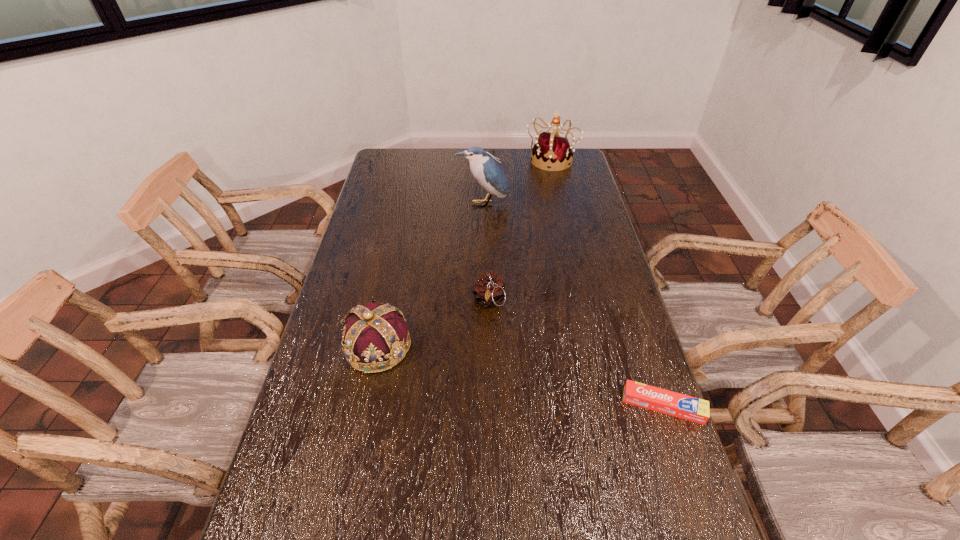
Where is `object positioned at the left edge`? This screenshot has width=960, height=540. object positioned at the left edge is located at coordinates (376, 337).

I want to click on toothpaste situated at the right edge, so click(x=686, y=407).

The image size is (960, 540). In order to click on tiara that is at the right edge in this screenshot , I will do `click(552, 150)`.

Where is `object at the far right corner`? Image resolution: width=960 pixels, height=540 pixels. object at the far right corner is located at coordinates (552, 150).

The image size is (960, 540). Identify the location of free space at the left edge of the desktop. (379, 270).

The image size is (960, 540). Find the location of `vacant space at the right edge of the desktop`. vacant space at the right edge of the desktop is located at coordinates (555, 177).

Locate an element on the screen. The image size is (960, 540). free point at the far right corner is located at coordinates (577, 148).

Image resolution: width=960 pixels, height=540 pixels. What are the coordinates of `free space between the second shortest object and the bird` in the screenshot? It's located at (486, 253).

Find the location of `vacant point located between the tiara and the third shortest object`. vacant point located between the tiara and the third shortest object is located at coordinates (464, 253).

Locate an element on the screen. Image resolution: width=960 pixels, height=540 pixels. vacant area between the third nearest object and the tiara is located at coordinates (520, 231).